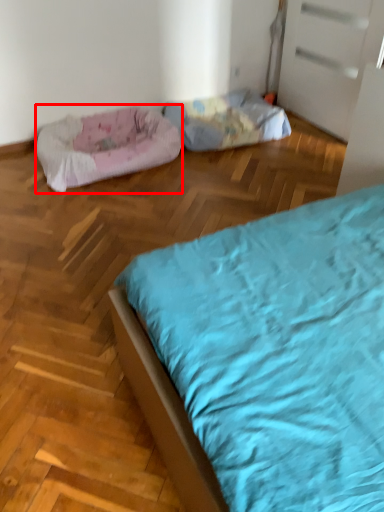
Question: From the image's perspective, what is the correct spatial relationship of dog bed (annotated by the red box) in relation to dog bed?

Choices:
 (A) below
 (B) above

Answer: (A)